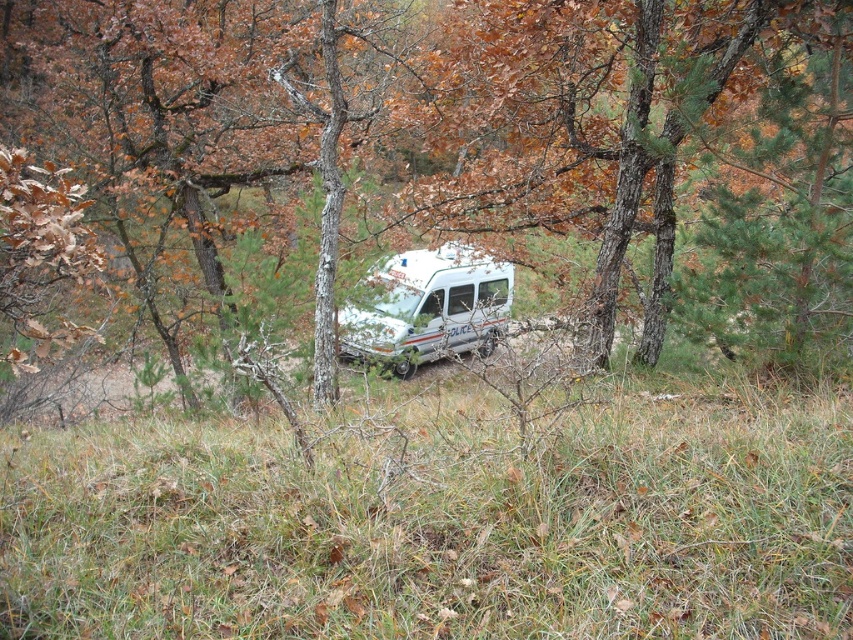
You are planning to set up a tent in the wooded area shown. Considering the brown bark tree at center and the green grass at center, which object would be more suitable for placing the tent base? Explain your reasoning based on their sizes.

The brown bark tree at center is larger than the green grass at center. Therefore, the green grass at center would be more suitable for placing the tent base since it occupies a smaller area and provides a clearer space for setup.

You are standing at the point labeled point (451, 154) in the image. What is the nearest object to you?

The nearest object to you is the brown bark tree at center, as the point (451, 154) indicates its location.